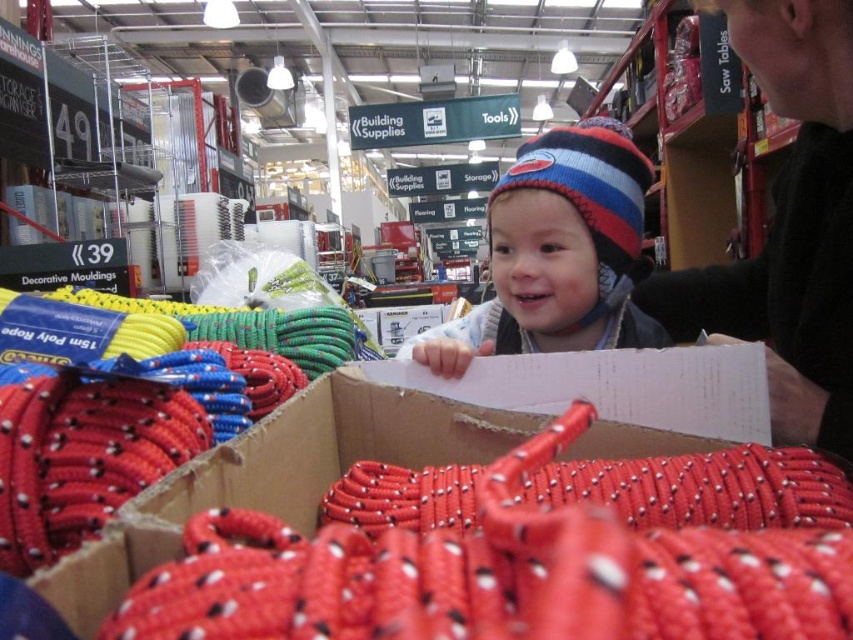
Question: In this image, where is black sweater at upper right located relative to striped knit hat at upper center?

Choices:
 (A) below
 (B) above

Answer: (B)

Question: Can you confirm if black sweater at upper right is wider than striped knit hat at upper center?

Choices:
 (A) no
 (B) yes

Answer: (A)

Question: Which point is closer to the camera taking this photo?

Choices:
 (A) (778, 252)
 (B) (459, 337)

Answer: (A)

Question: Does black sweater at upper right have a lesser width compared to striped knit hat at upper center?

Choices:
 (A) yes
 (B) no

Answer: (A)

Question: Which of the following is the closest to the observer?

Choices:
 (A) black sweater at upper right
 (B) striped knit hat at upper center

Answer: (A)